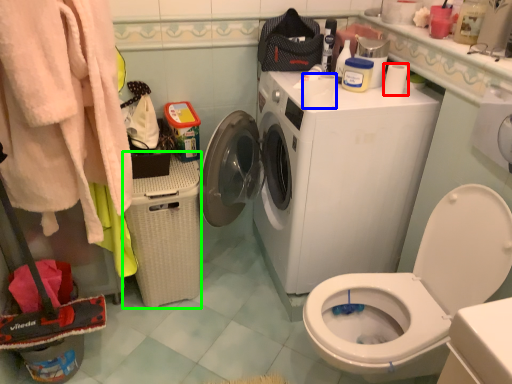
Question: Which is farther away from toilet paper (highlighted by a red box)? toilet paper (highlighted by a blue box) or laundry basket (highlighted by a green box)?

Choices:
 (A) toilet paper
 (B) laundry basket

Answer: (B)